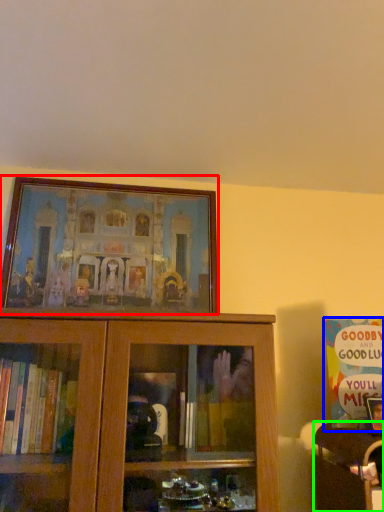
Question: Which is farther away from picture frame (highlighted by a red box)? book (highlighted by a blue box) or furniture (highlighted by a green box)?

Choices:
 (A) book
 (B) furniture

Answer: (B)